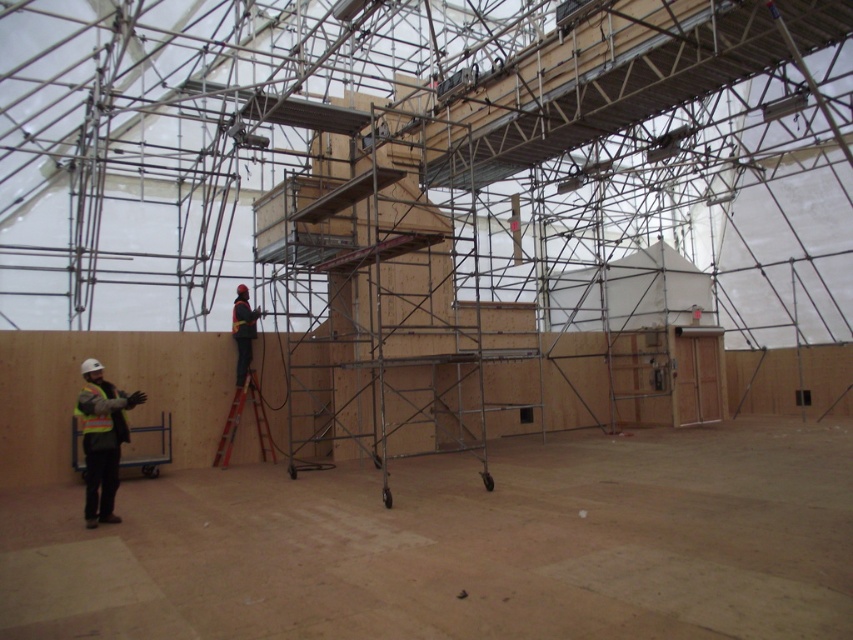
Question: Among these points, which one is farthest from the camera?

Choices:
 (A) (244, 324)
 (B) (97, 497)
 (C) (260, 417)
 (D) (105, 419)

Answer: (C)

Question: Is red wooden ladder at center positioned in front of dark blue fabric construction worker at center?

Choices:
 (A) yes
 (B) no

Answer: (A)

Question: Is reflective yellow safety vest at lower left below dark blue fabric construction worker at center?

Choices:
 (A) no
 (B) yes

Answer: (B)

Question: Does red wooden ladder at center come behind dark blue fabric construction worker at center?

Choices:
 (A) yes
 (B) no

Answer: (B)

Question: Which object is the farthest from the dark blue fabric construction worker at center?

Choices:
 (A) red wooden ladder at center
 (B) reflective yellow safety vest at lower left
 (C) reflective yellow-green safety vest at lower left

Answer: (C)

Question: Which object is the farthest from the reflective yellow-green safety vest at lower left?

Choices:
 (A) red wooden ladder at center
 (B) dark blue fabric construction worker at center
 (C) reflective yellow safety vest at lower left

Answer: (B)